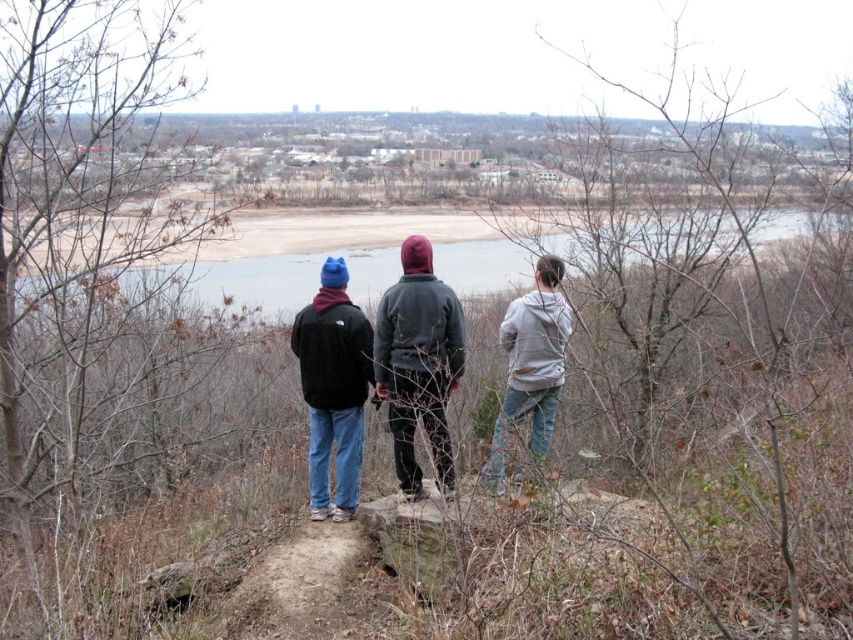
Who is more forward, (415, 310) or (534, 428)?

Point (415, 310)

This screenshot has width=853, height=640. Describe the element at coordinates (418, 362) in the screenshot. I see `dark gray hoodie at center` at that location.

Locate an element on the screen. The width and height of the screenshot is (853, 640). dark gray hoodie at center is located at coordinates (418, 362).

Is point (241, 232) in front of point (347, 420)?

No, it is not.

What do you see at coordinates (280, 276) in the screenshot? I see `gray smooth water at center` at bounding box center [280, 276].

You are a GUI agent. You are given a task and a screenshot of the screen. Output one action in this format:
    pyautogui.click(x=<x>, y=<y>)
    Task: Click on the gray smooth water at center
    The width and height of the screenshot is (853, 640).
    Given the screenshot: What is the action you would take?
    pyautogui.click(x=280, y=276)

Who is shorter, gray smooth water at center or dark gray hoodie at center?

dark gray hoodie at center is shorter.

Can you confirm if gray smooth water at center is thinner than dark gray hoodie at center?

No, gray smooth water at center is not thinner than dark gray hoodie at center.

Identify the location of gray smooth water at center. This screenshot has width=853, height=640. (280, 276).